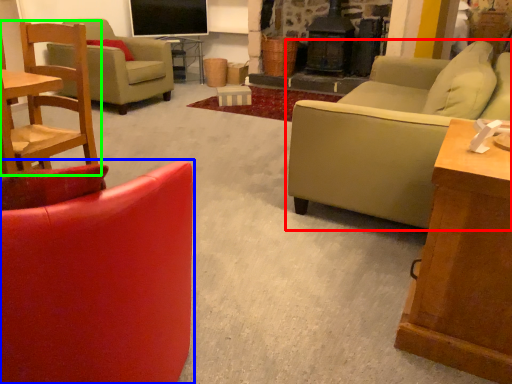
Question: Which is nearer to the studio couch (highlighted by a red box)? chair (highlighted by a blue box) or chair (highlighted by a green box).

Choices:
 (A) chair
 (B) chair

Answer: (A)